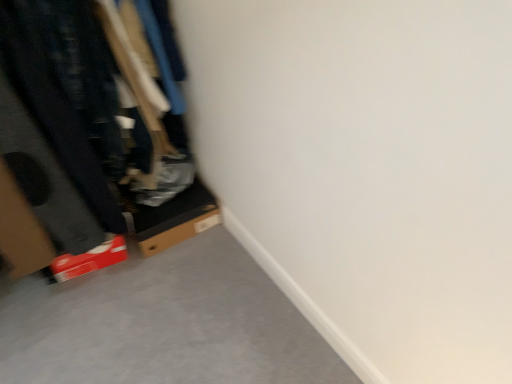
The height and width of the screenshot is (384, 512). Find the location of `free space above cardboard box at lower left (from a real-world perspective)`. free space above cardboard box at lower left (from a real-world perspective) is located at coordinates (169, 201).